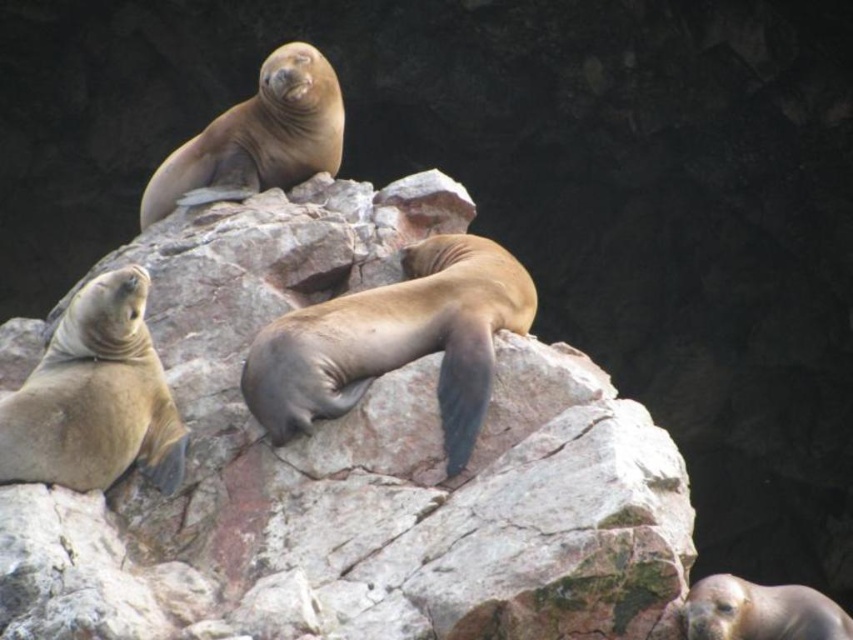
You are a marine biologist observing the sea lions and their environment. You notice the brown rough rock at center and the brown smooth seal at center. Which object is taller?

The brown rough rock at center is taller than the brown smooth seal at center.

You are a photographer standing in front of the brown rough rock at center and the brown smooth seal at center. You want to take a clear photo of the seal. Which object should you move closer to in order to focus on the seal?

To focus on the brown smooth seal at center, you should move closer to the brown rough rock at center because it is closer to the viewer than the seal. By moving closer to the rock, you can adjust your focus to capture the seal more clearly.

You are a marine biologist observing the sea lions. You need to determine which object at the center has a greater width between the brown rough rock at center and the brown smooth seal at center. Which one is wider?

The brown rough rock at center is wider than the brown smooth seal at center according to the description.